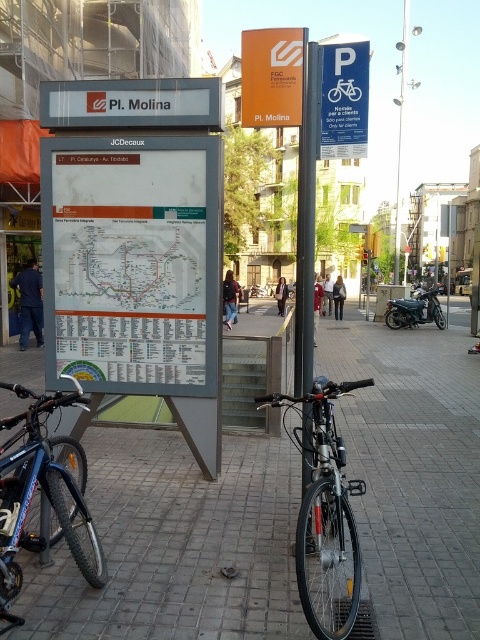
Who is shorter, white plastic sign at center or orange plastic sign at center?

With less height is white plastic sign at center.

Is white plastic sign at center taller than orange plastic sign at center?

No.

Where is `white plastic sign at center`? The image size is (480, 640). white plastic sign at center is located at coordinates (135, 244).

You are a GUI agent. You are given a task and a screenshot of the screen. Output one action in this format:
    pyautogui.click(x=<x>, y=<y>)
    Task: Click on the white plastic sign at center
    The image size is (480, 640).
    Given the screenshot: What is the action you would take?
    pyautogui.click(x=135, y=244)

Is silver metallic bicycle at center in front of black metal pole at center?

Yes, it is.

Based on the photo, does silver metallic bicycle at center appear over black metal pole at center?

Incorrect, silver metallic bicycle at center is not positioned above black metal pole at center.

Where is `silver metallic bicycle at center`? Image resolution: width=480 pixels, height=640 pixels. silver metallic bicycle at center is located at coordinates (325, 516).

I want to click on silver metallic bicycle at center, so click(x=325, y=516).

This screenshot has height=640, width=480. Find the location of `gray concrete pavement at center`. gray concrete pavement at center is located at coordinates point(178,545).